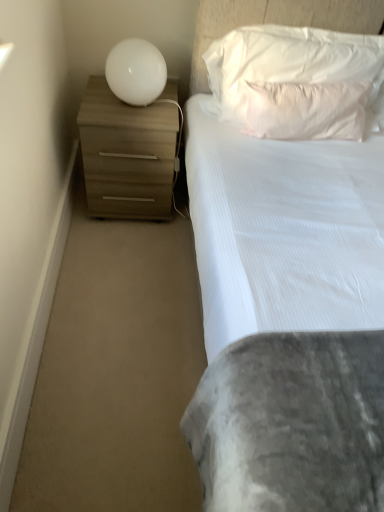
I want to click on vacant area situated below white glossy sphere at upper left (from a real-world perspective), so click(130, 106).